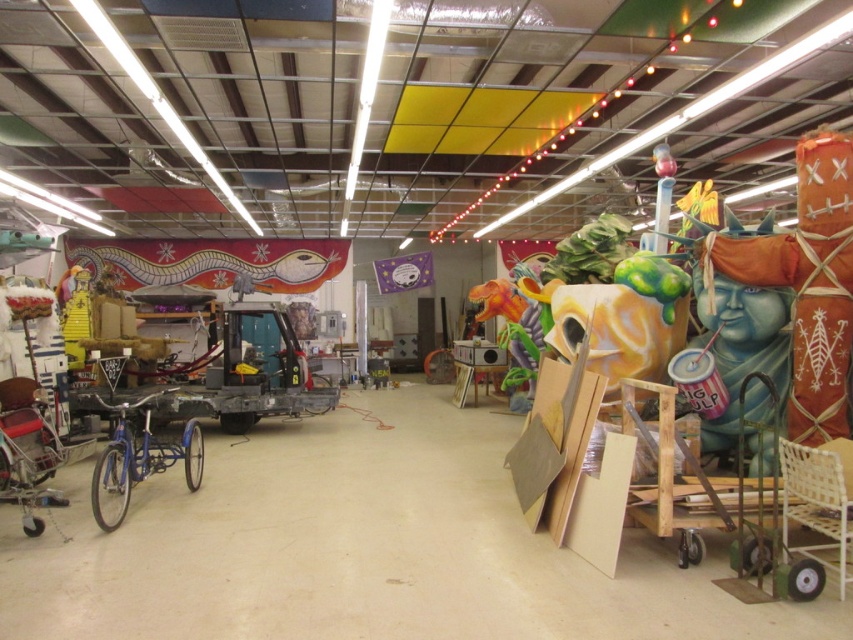
Question: Among these objects, which one is farthest from the camera?

Choices:
 (A) blue painted statue at right
 (B) shiny blue bicycle at lower left

Answer: (A)

Question: Is blue painted statue at right closer to the viewer compared to shiny blue bicycle at lower left?

Choices:
 (A) no
 (B) yes

Answer: (A)

Question: Does blue painted statue at right have a smaller size compared to shiny blue bicycle at lower left?

Choices:
 (A) yes
 (B) no

Answer: (B)

Question: Which of the following is the closest to the observer?

Choices:
 (A) [750, 387]
 (B) [138, 472]

Answer: (B)

Question: Is blue painted statue at right bigger than shiny blue bicycle at lower left?

Choices:
 (A) yes
 (B) no

Answer: (A)